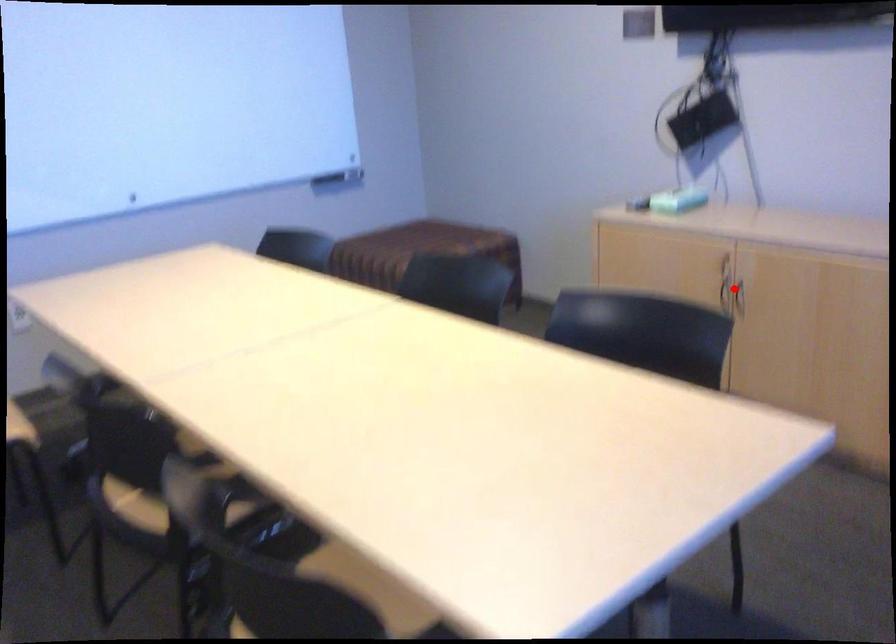
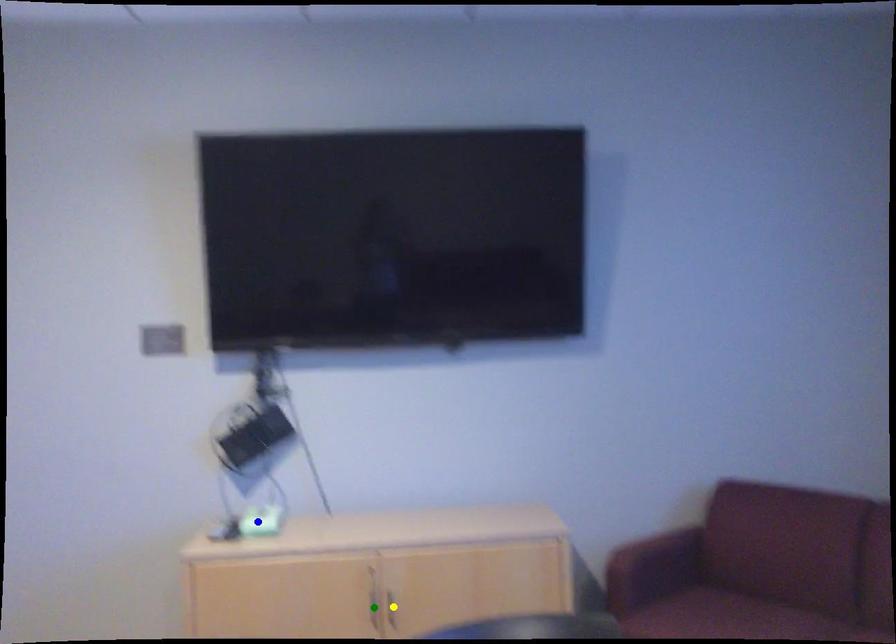
Question: I am providing you with two images of the same scene from different viewpoints. A red point is marked on the first image. You are given multiple points on the second image. In image 2, which mark is for the same physical point as the one in image 1?

Choices:
 (A) blue point
 (B) green point
 (C) yellow point

Answer: (B)